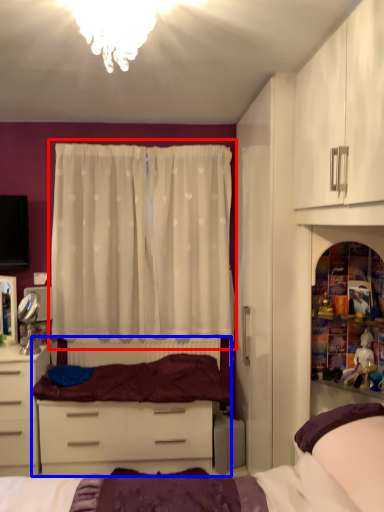
Question: Which object appears farthest to the camera in this image, curtain (highlighted by a red box) or entertainment center (highlighted by a blue box)?

Choices:
 (A) curtain
 (B) entertainment center

Answer: (A)